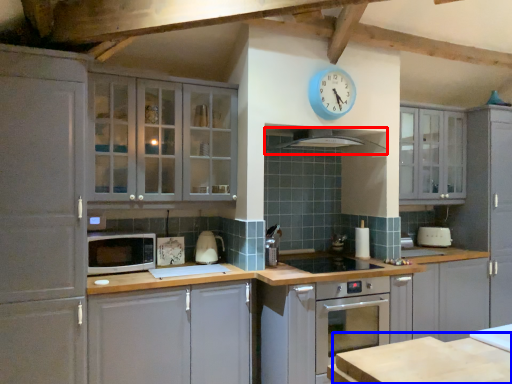
Question: Among these objects, which one is farthest to the camera, exhaust hood (highlighted by a red box) or table (highlighted by a blue box)?

Choices:
 (A) exhaust hood
 (B) table

Answer: (A)